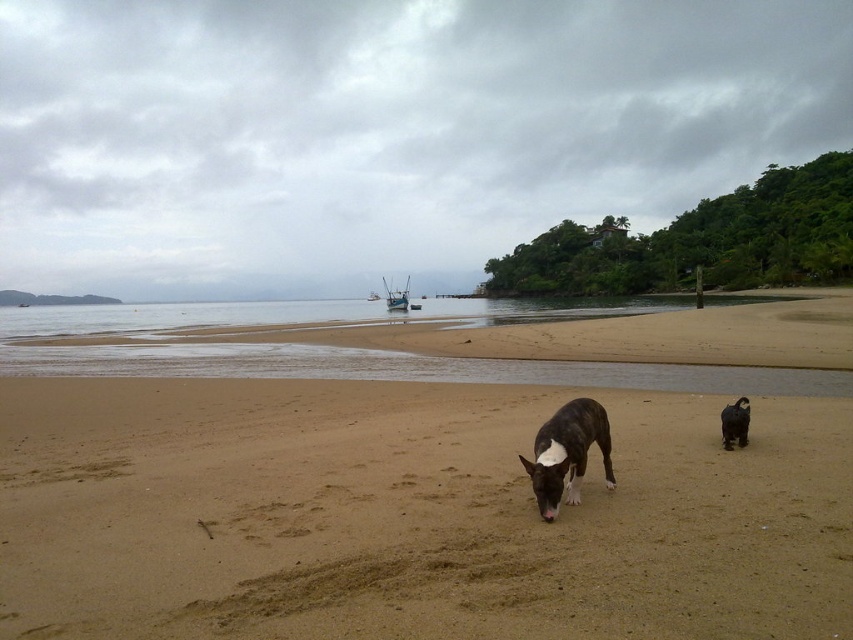
You are standing on the brown sandy beach at center and want to throw a ball to your dog, the brown fur dog at center. Which direction should you throw the ball so it lands in front of the dog?

The brown sandy beach at center is in front of the brown fur dog at center, so you should throw the ball towards the direction of the brown sandy beach at center to land it in front of the dog.

You are a photographer standing at the shore. You want to capture a photo where both the white glossy dog at center and the brown fur dog at center are visible. Based on their positions, which dog should you focus on first to ensure both are in the frame?

The white glossy dog at center is above the brown fur dog at center, so focusing on the white glossy dog at center first will ensure the brown fur dog at center is also in the frame below it.